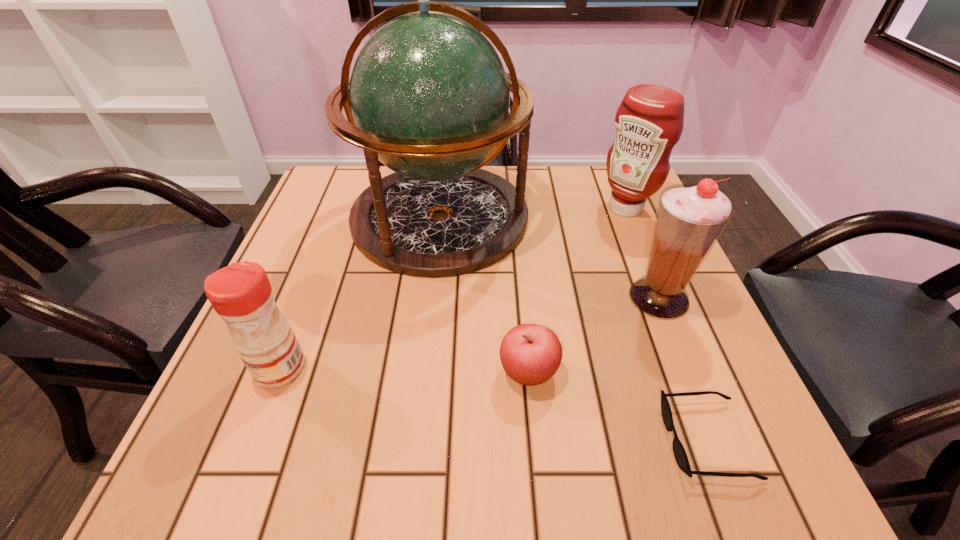
The width and height of the screenshot is (960, 540). I want to click on free space that is in between the nearer condiment and the sunglasses, so click(x=493, y=404).

Where is `unoccupied area between the fourth tallest object and the taller condiment`? This screenshot has width=960, height=540. unoccupied area between the fourth tallest object and the taller condiment is located at coordinates (453, 288).

The image size is (960, 540). Find the location of `free area in between the nearest object and the globe`. free area in between the nearest object and the globe is located at coordinates (573, 329).

I want to click on empty space that is in between the apple and the taller condiment, so click(577, 291).

At what (x,y) coordinates should I click in order to perform the action: click on free space between the tallest object and the sunglasses. Please return your answer as a coordinate pair (x, y). Looking at the image, I should click on (573, 329).

Image resolution: width=960 pixels, height=540 pixels. What are the coordinates of `free space that is in between the smoothie and the right condiment` in the screenshot? It's located at (642, 253).

At what (x,y) coordinates should I click in order to perform the action: click on the third closest object to the shorter condiment. Please return your answer as a coordinate pair (x, y). The width and height of the screenshot is (960, 540). Looking at the image, I should click on (680, 455).

The image size is (960, 540). What are the coordinates of `object that stands as the second closest to the smoothie` in the screenshot? It's located at (530, 354).

Image resolution: width=960 pixels, height=540 pixels. I want to click on vacant space that satisfies the following two spatial constraints: 1. on the front-facing side of the smoothie; 2. on the right side of the globe, so click(431, 298).

Image resolution: width=960 pixels, height=540 pixels. What are the coordinates of `vacant area that satisfies the following two spatial constraints: 1. on the front side of the farther condiment; 2. on the front-facing side of the sunglasses` in the screenshot? It's located at (720, 440).